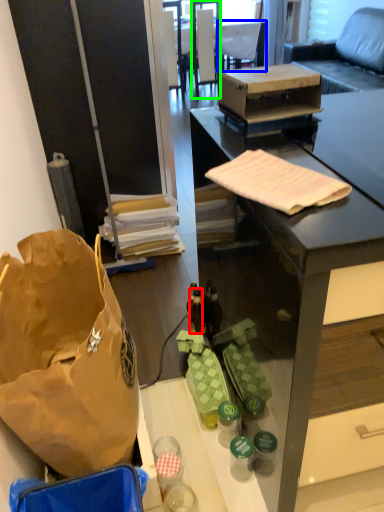
Question: Which is farther away from bottle (highlighted by a red box)? armchair (highlighted by a blue box) or chair (highlighted by a green box)?

Choices:
 (A) armchair
 (B) chair

Answer: (A)